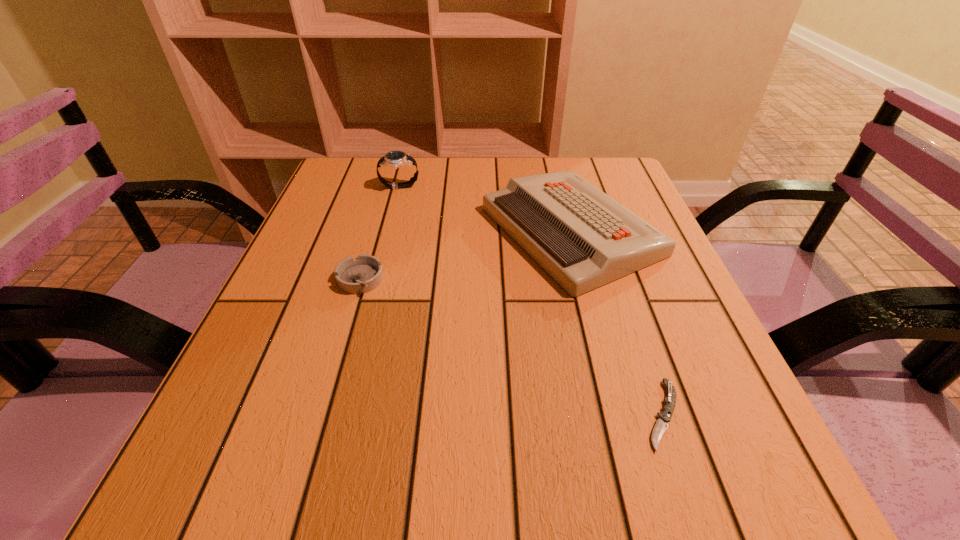
Where is `the tallest object`? Image resolution: width=960 pixels, height=540 pixels. the tallest object is located at coordinates (394, 159).

Locate an element on the screen. The width and height of the screenshot is (960, 540). the second tallest object is located at coordinates (583, 238).

The height and width of the screenshot is (540, 960). Identify the location of ashtray. (363, 274).

Where is `the shortest object`? This screenshot has height=540, width=960. the shortest object is located at coordinates (664, 417).

Locate an element on the screen. This screenshot has width=960, height=540. pocketknife is located at coordinates (664, 417).

Identify the location of vacant space located on the front of the watch. (378, 267).

You are a GUI agent. You are given a task and a screenshot of the screen. Output one action in this format:
    pyautogui.click(x=<x>, y=<y>)
    Task: Click on the vacant space located on the front of the computer keyboard
    
    Given the screenshot: What is the action you would take?
    pyautogui.click(x=602, y=348)

Image resolution: width=960 pixels, height=540 pixels. I want to click on free space located on the front of the ashtray, so click(333, 372).

In order to click on free space located 0.080m on the left of the shortest object in this screenshot , I will do `click(588, 415)`.

I want to click on watch that is at the far edge, so click(x=394, y=159).